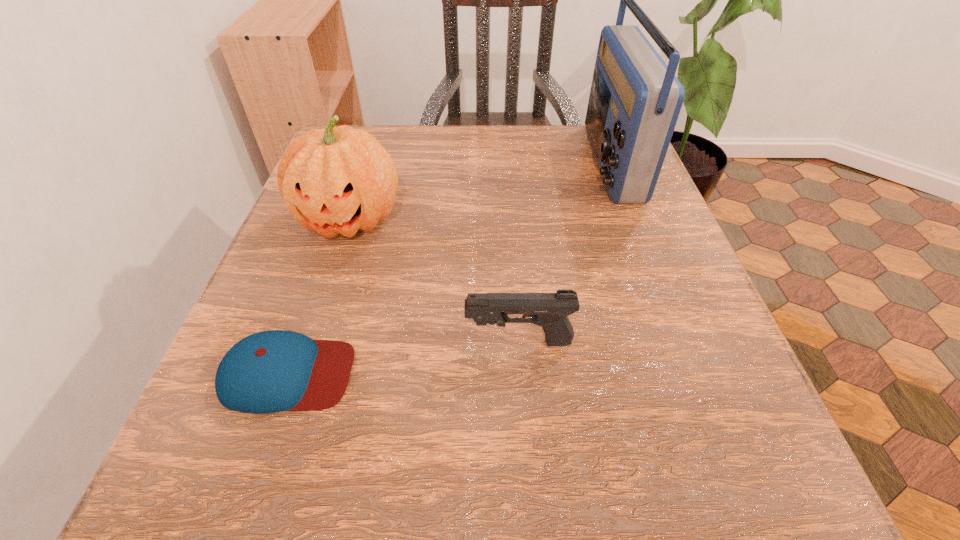
Locate an element on the screen. Image resolution: width=960 pixels, height=540 pixels. vacant space located 0.300m at the barrel of the second shortest object is located at coordinates (261, 342).

Locate an element on the screen. This screenshot has height=540, width=960. vacant space situated at the barrel of the second shortest object is located at coordinates (316, 342).

Locate an element on the screen. The height and width of the screenshot is (540, 960). free point located at the barrel of the second shortest object is located at coordinates (377, 342).

The width and height of the screenshot is (960, 540). What are the coordinates of `free location located 0.230m with the bill of the baseball cap facing forward` in the screenshot? It's located at (519, 374).

This screenshot has width=960, height=540. I want to click on object that is at the far edge, so click(x=635, y=99).

Locate an element on the screen. This screenshot has height=540, width=960. pumpkin at the left edge is located at coordinates (337, 180).

In order to click on baseball cap that is at the left edge in this screenshot , I will do `click(271, 371)`.

You are a GUI agent. You are given a task and a screenshot of the screen. Output one action in this format:
    pyautogui.click(x=<x>, y=<y>)
    Task: Click on the object present at the right edge
    The image size is (960, 540).
    Given the screenshot: What is the action you would take?
    pyautogui.click(x=635, y=99)

Where is `object at the far right corner`? This screenshot has width=960, height=540. object at the far right corner is located at coordinates (635, 99).

At what (x,y) coordinates should I click in order to perform the action: click on free spot at the far edge of the desktop. Please return your answer as a coordinate pair (x, y). Looking at the image, I should click on (420, 164).